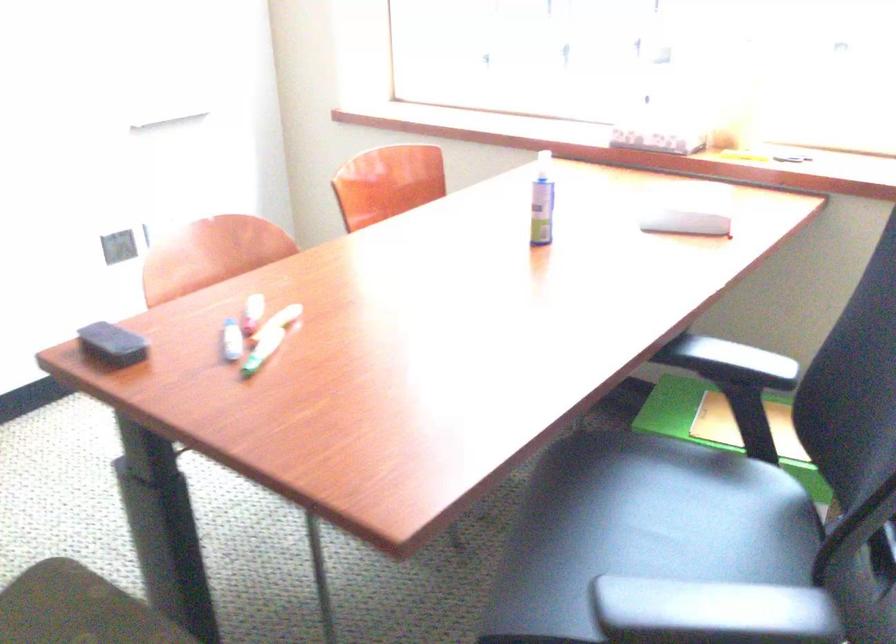
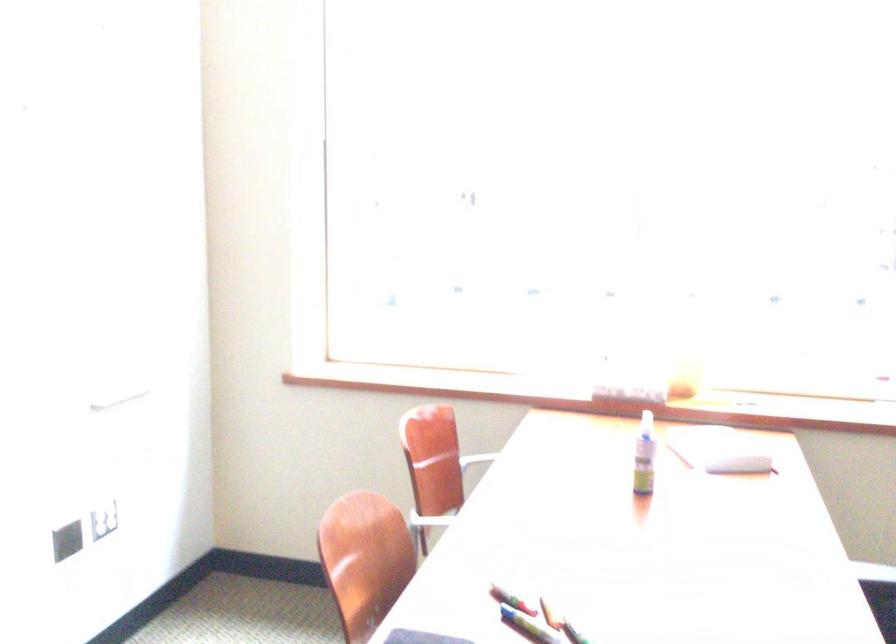
Question: What movement of the cameraman would produce the second image?

Choices:
 (A) Left
 (B) Right
 (C) Forward
 (D) Backward

Answer: (A)